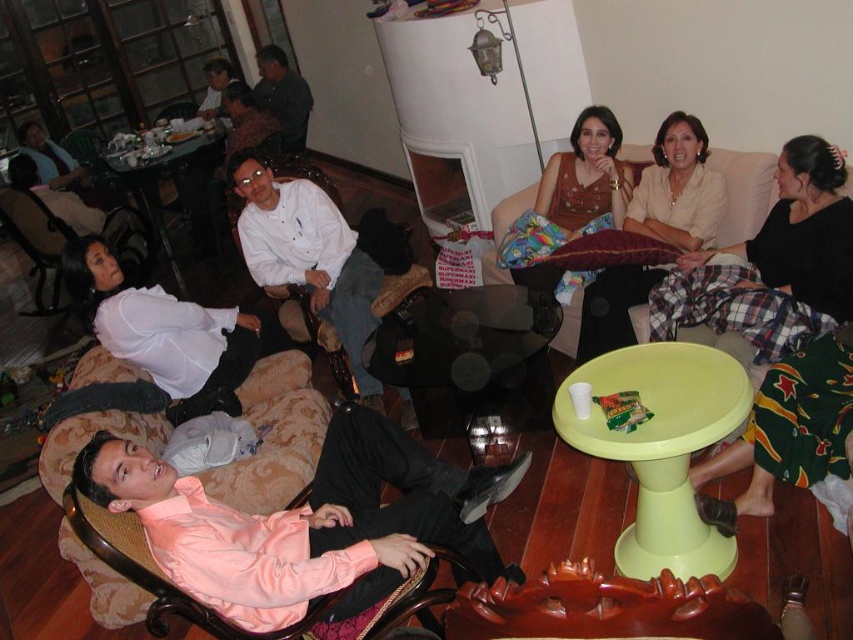
Is white satin blouse at lower left smaller than light beige fabric couch at upper right?

Incorrect, white satin blouse at lower left is not smaller in size than light beige fabric couch at upper right.

Does white satin blouse at lower left have a greater width compared to light beige fabric couch at upper right?

Yes, white satin blouse at lower left is wider than light beige fabric couch at upper right.

Which is in front, point (210, 364) or point (763, 180)?

Point (763, 180)

The width and height of the screenshot is (853, 640). I want to click on white satin blouse at lower left, so click(161, 332).

Does velvet-like beige couch at lower left appear over brown satin dress at center?

No.

The image size is (853, 640). Describe the element at coordinates (274, 436) in the screenshot. I see `velvet-like beige couch at lower left` at that location.

Locate an element on the screen. The image size is (853, 640). velvet-like beige couch at lower left is located at coordinates (274, 436).

Between point (177, 394) and point (635, 296), which one is positioned behind?

The point (635, 296) is behind.

Who is more forward, (158, 320) or (637, 195)?

Point (158, 320)

Where is `white satin blouse at lower left`? This screenshot has width=853, height=640. white satin blouse at lower left is located at coordinates [161, 332].